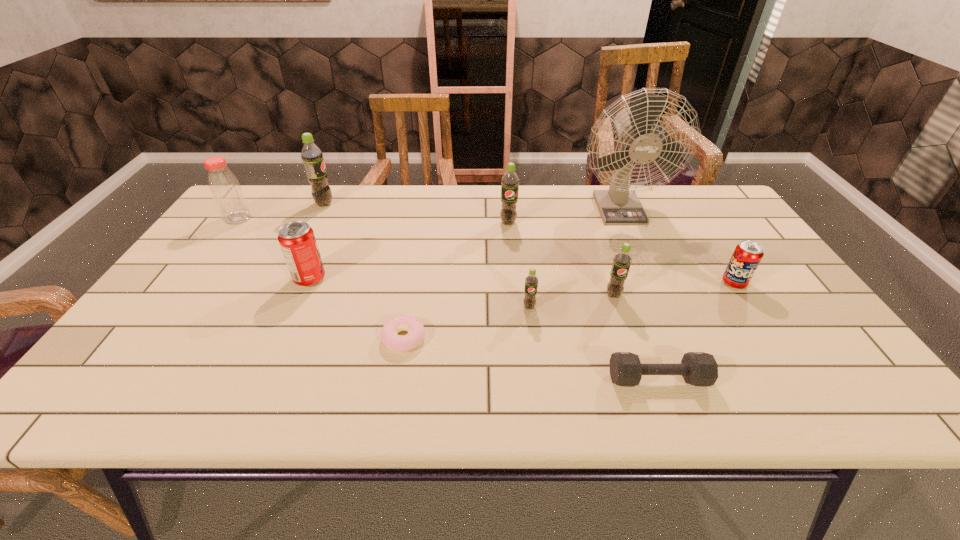
Image resolution: width=960 pixels, height=540 pixels. What are the coordinates of `blank space that satisfies the following two spatial constraints: 1. on the front label of the nearest object; 2. on the right side of the second soda from right to left` in the screenshot? It's located at (641, 379).